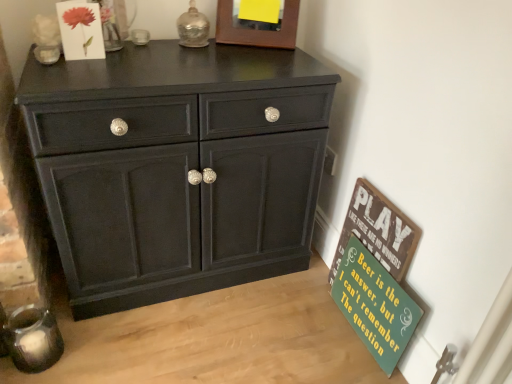
Question: Relative to matte paper flower at upper left, is wooden picture frame at upper center in front or behind?

Choices:
 (A) behind
 (B) front

Answer: (A)

Question: Is point tap(229, 6) positioned closer to the camera than point tap(62, 14)?

Choices:
 (A) farther
 (B) closer

Answer: (A)

Question: Which object is the closest to the green painted wood signboard at lower right, placed as the second bulletin board when sorted from bottom to top?

Choices:
 (A) wooden picture frame at upper center
 (B) matte paper flower at upper left
 (C) matte black cabinet at center
 (D) green wood signboard at lower right, which is counted as the 1th bulletin board, starting from the bottom

Answer: (D)

Question: Estimate the real-world distances between objects in this image. Which object is farther from the green wood signboard at lower right, which is counted as the 1th bulletin board, starting from the bottom?

Choices:
 (A) matte black cabinet at center
 (B) matte paper flower at upper left
 (C) green painted wood signboard at lower right, which ranks as the 1th bulletin board in top-to-bottom order
 (D) wooden picture frame at upper center

Answer: (B)